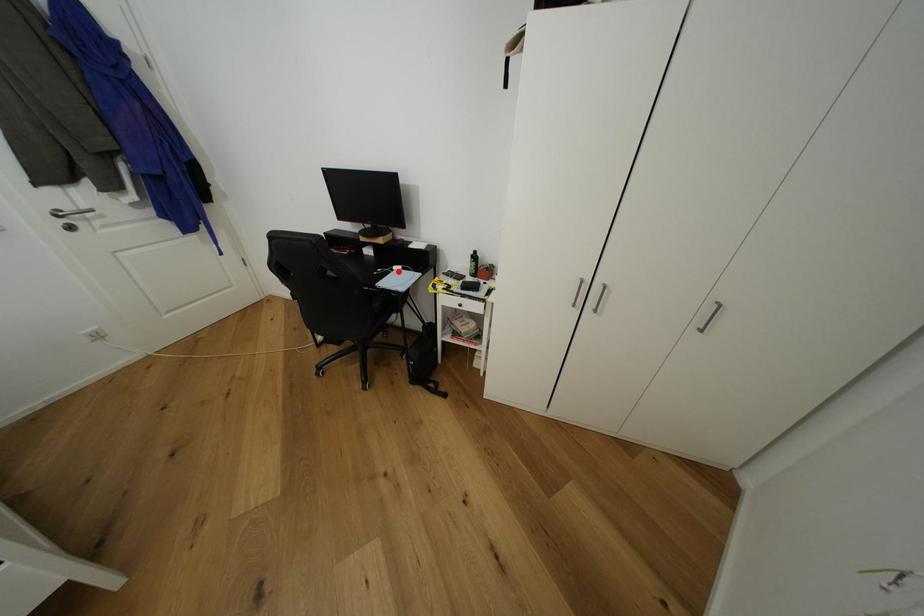
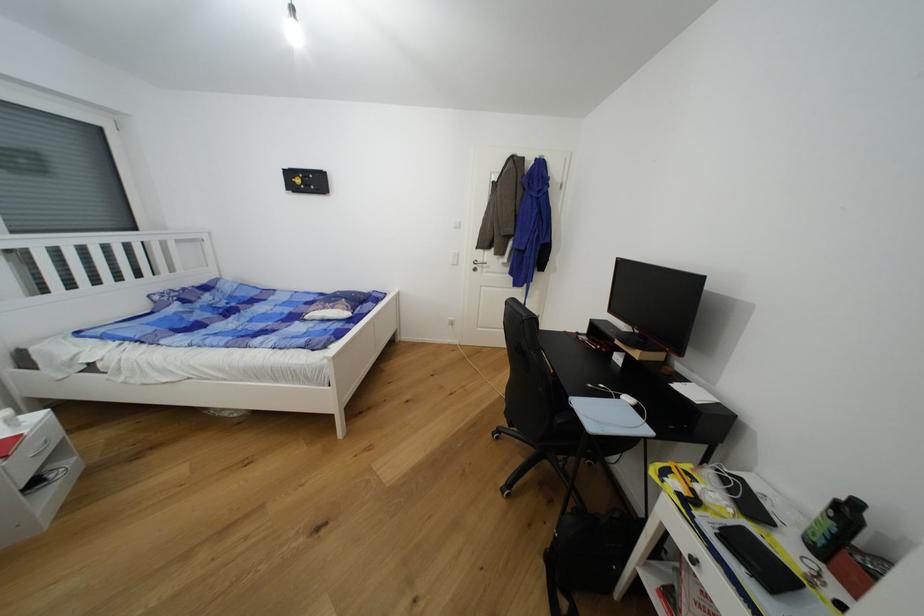
Find the pixel in the second image that matches the highlighted location in the first image.

(623, 399)